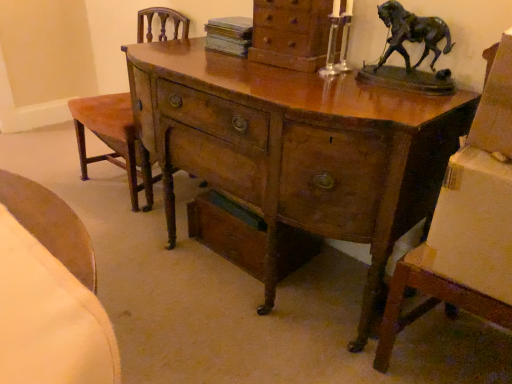
Locate an element on the screen. The image size is (512, 384). wooden desk at center is located at coordinates (297, 148).

The height and width of the screenshot is (384, 512). What do you see at coordinates (297, 148) in the screenshot?
I see `wooden desk at center` at bounding box center [297, 148].

Locate an element on the screen. Image resolution: width=512 pixels, height=384 pixels. wooden chest of drawers at upper center is located at coordinates (291, 33).

In the scene shown: Between wooden drawer at lower center and velvet orange armchair at left, which one has smaller size?

wooden drawer at lower center.

Is wooden drawer at lower center to the left of velvet orange armchair at left from the viewer's perspective?

No, wooden drawer at lower center is not to the left of velvet orange armchair at left.

Where is `drawer below the velvet orange armchair at left (from a real-world perspective)`? drawer below the velvet orange armchair at left (from a real-world perspective) is located at coordinates (229, 230).

Is wooden drawer at lower center not near velvet orange armchair at left?

No, wooden drawer at lower center is not far from velvet orange armchair at left.

From a real-world perspective, is wooden chest of drawers at upper center on wooden drawer at lower center?

Yes, from a real-world perspective, wooden chest of drawers at upper center is over wooden drawer at lower center

Is wooden chest of drawers at upper center turned away from wooden drawer at lower center?

wooden chest of drawers at upper center is not turned away from wooden drawer at lower center.

Can you confirm if velvet orange armchair at left is smaller than wooden drawer at lower center?

Incorrect, velvet orange armchair at left is not smaller in size than wooden drawer at lower center.

Locate an element on the screen. drawer located in front of the velvet orange armchair at left is located at coordinates (229, 230).

Which is behind, velvet orange armchair at left or wooden drawer at lower center?

Positioned behind is velvet orange armchair at left.

From a real-world perspective, does wooden chest of drawers at upper center stand above wooden desk at center?

Correct, in the physical world, wooden chest of drawers at upper center is higher than wooden desk at center.

Looking at this image, could you tell me if wooden chest of drawers at upper center is turned towards wooden desk at center?

No, wooden chest of drawers at upper center is not oriented towards wooden desk at center.

Which object is thinner, wooden chest of drawers at upper center or wooden desk at center?

wooden chest of drawers at upper center.

Based on the photo, measure the distance from wooden chest of drawers at upper center to wooden desk at center.

wooden chest of drawers at upper center is 33.63 centimeters from wooden desk at center.

I want to click on chest of drawers above the wooden drawer at lower center (from the image's perspective), so click(x=291, y=33).

Are wooden drawer at lower center and wooden chest of drawers at upper center located far from each other?

No, there isn't a large distance between wooden drawer at lower center and wooden chest of drawers at upper center.

Considering the positions of point (213, 230) and point (314, 40), is point (213, 230) closer or farther from the camera than point (314, 40)?

Point (213, 230) is farther from the camera than point (314, 40).

Would you say wooden drawer at lower center is outside wooden chest of drawers at upper center?

Yes, wooden drawer at lower center is outside of wooden chest of drawers at upper center.

Which is less distant, [356,230] or [246,242]?

Point [356,230].

From the image's perspective, is wooden desk at center located above or below wooden drawer at lower center?

Clearly, from the image's perspective, wooden desk at center is above wooden drawer at lower center.

Can you confirm if wooden desk at center is bigger than wooden drawer at lower center?

Correct, wooden desk at center is larger in size than wooden drawer at lower center.

Can you see wooden desk at center touching wooden drawer at lower center?

They are not placed beside each other.

Which is correct: velvet orange armchair at left is inside wooden chest of drawers at upper center, or outside of it?

velvet orange armchair at left lies outside wooden chest of drawers at upper center.

Which of these two, velvet orange armchair at left or wooden chest of drawers at upper center, is smaller?

wooden chest of drawers at upper center is smaller.

Is point (91, 108) closer or farther from the camera than point (324, 30)?

Point (91, 108).

Locate an element on the screen. The height and width of the screenshot is (384, 512). armchair behind the wooden drawer at lower center is located at coordinates (114, 141).

Where is `chest of drawers in front of the wooden drawer at lower center`? The image size is (512, 384). chest of drawers in front of the wooden drawer at lower center is located at coordinates (291, 33).

Which object lies further to the anchor point wooden desk at center, velvet orange armchair at left or wooden chest of drawers at upper center?

velvet orange armchair at left is positioned further to the anchor wooden desk at center.

Based on their spatial positions, is velvet orange armchair at left or wooden drawer at lower center closer to wooden desk at center?

Based on the image, wooden drawer at lower center appears to be nearer to wooden desk at center.

Looking at the image, which one is located closer to velvet orange armchair at left, wooden chest of drawers at upper center or wooden drawer at lower center?

The object closer to velvet orange armchair at left is wooden drawer at lower center.

Estimate the real-world distances between objects in this image. Which object is closer to velvet orange armchair at left, wooden drawer at lower center or wooden desk at center?

wooden drawer at lower center lies closer to velvet orange armchair at left than the other object.

From the image, which object appears to be farther from wooden chest of drawers at upper center, wooden desk at center or velvet orange armchair at left?

velvet orange armchair at left is positioned further to the anchor wooden chest of drawers at upper center.

When comparing their distances from velvet orange armchair at left, does wooden desk at center or wooden chest of drawers at upper center seem further?

Among the two, wooden chest of drawers at upper center is located further to velvet orange armchair at left.

Considering their positions, is wooden chest of drawers at upper center positioned closer to wooden desk at center than velvet orange armchair at left?

The object closer to wooden desk at center is wooden chest of drawers at upper center.

Looking at the image, which one is located further to wooden chest of drawers at upper center, velvet orange armchair at left or wooden desk at center?

velvet orange armchair at left lies further to wooden chest of drawers at upper center than the other object.

Identify the location of drawer between wooden desk at center and velvet orange armchair at left from front to back. (229, 230).

Where is `drawer between velvet orange armchair at left and wooden chest of drawers at upper center in the horizontal direction`? The height and width of the screenshot is (384, 512). drawer between velvet orange armchair at left and wooden chest of drawers at upper center in the horizontal direction is located at coordinates (229, 230).

Find the location of a particular element. The image size is (512, 384). desk between velvet orange armchair at left and wooden chest of drawers at upper center in the horizontal direction is located at coordinates (297, 148).

Identify the location of desk between wooden chest of drawers at upper center and wooden drawer at lower center vertically. This screenshot has height=384, width=512. (297, 148).